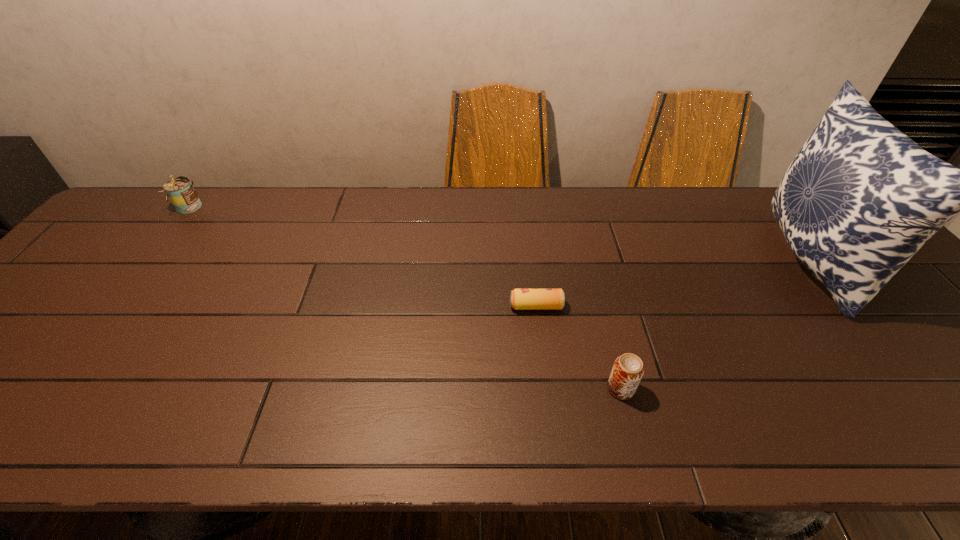
Where is `free space located 0.290m on the front surface of the tallest object`? This screenshot has width=960, height=540. free space located 0.290m on the front surface of the tallest object is located at coordinates (660, 261).

Locate an element on the screen. The width and height of the screenshot is (960, 540). vacant space located 0.240m on the right of the second tallest object is located at coordinates (283, 208).

Where is `vacant space positioned on the front of the second shortest object`? The width and height of the screenshot is (960, 540). vacant space positioned on the front of the second shortest object is located at coordinates (635, 443).

This screenshot has height=540, width=960. Find the location of `vacant space located on the right of the shorter beer can`. vacant space located on the right of the shorter beer can is located at coordinates (676, 306).

Locate an element on the screen. cushion that is at the far edge is located at coordinates (860, 198).

At what (x,y) coordinates should I click in order to perform the action: click on can that is positioned at the far edge. Please return your answer as a coordinate pair (x, y). Looking at the image, I should click on (180, 190).

Locate an element on the screen. object that is at the left edge is located at coordinates (180, 190).

Locate an element on the screen. object at the right edge is located at coordinates (860, 198).

Find the location of a particular element. object present at the far left corner is located at coordinates (180, 190).

I want to click on object at the far right corner, so click(860, 198).